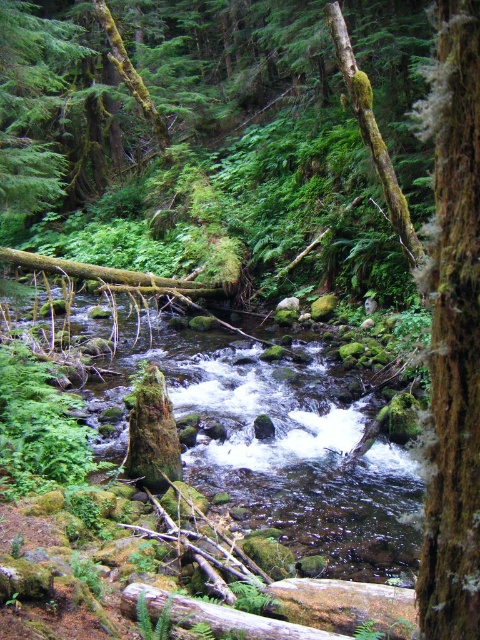
You are a hiker who wants to cross the stream. You see the clear water at center and the brown rough bark tree trunk at right. Which object is closer to the ground?

The clear water at center is located below the brown rough bark tree trunk at right, so the clear water at center is closer to the ground.

You are an explorer in the forest. You need to cross the stream but want to stay close to the brown rough bark tree trunk at right. Which direction should you head to reach the clear water at center while staying near the tree?

To stay near the brown rough bark tree trunk at right while reaching the clear water at center, head to the left since the clear water at center is located to the left of the tree trunk.